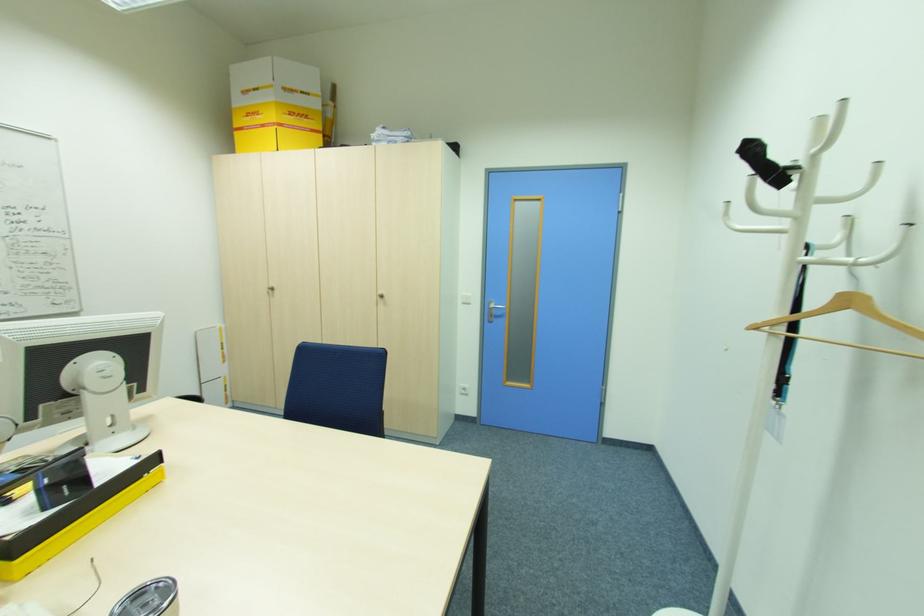
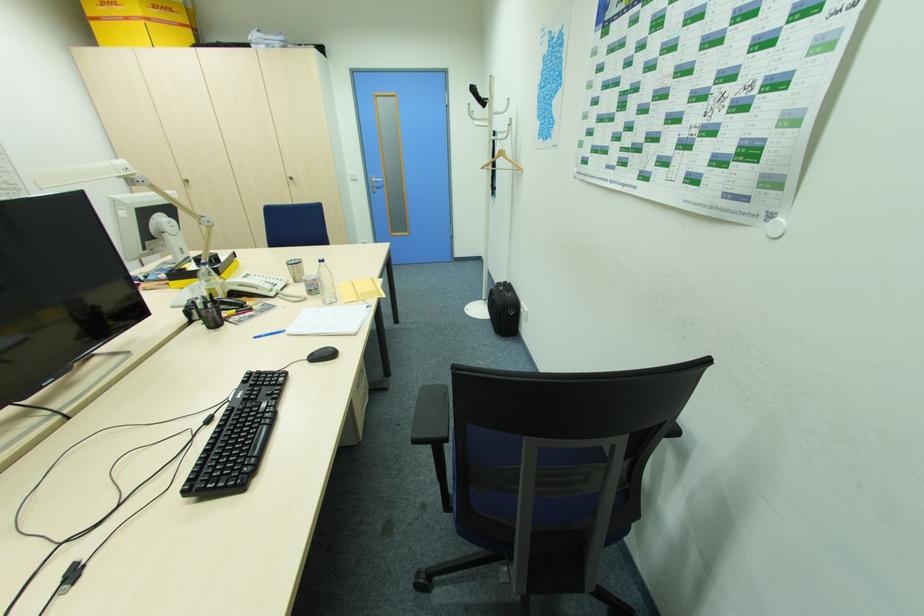
The point at (272, 293) is marked in the first image. Where is the corresponding point in the second image?

(188, 185)